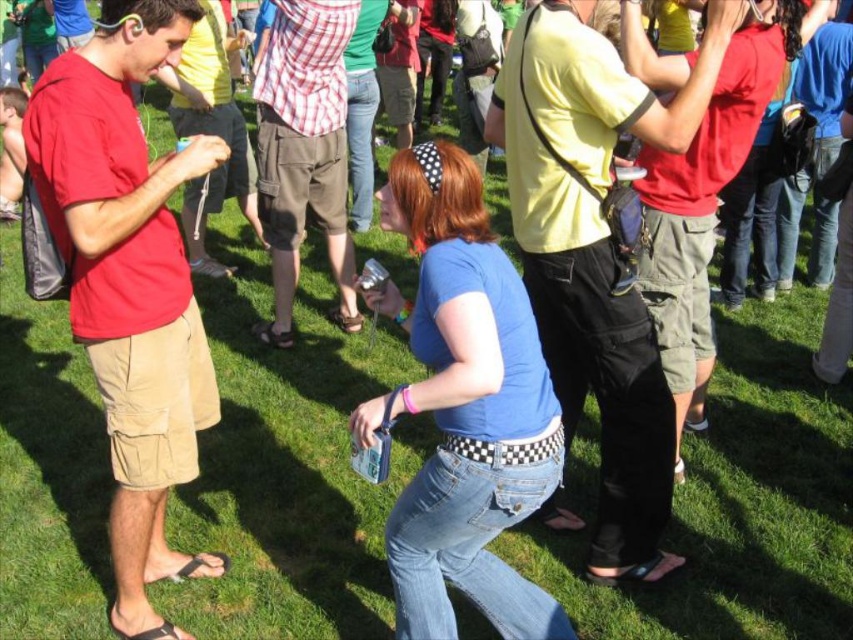
Is point (601, 316) behind point (281, 136)?

No, it is in front of (281, 136).

Does yellow cotton shirt at center have a lesser width compared to checkered fabric shirt at center?

Incorrect, yellow cotton shirt at center's width is not less than checkered fabric shirt at center's.

Which is behind, point (592, 58) or point (312, 49)?

The point (312, 49) is behind.

This screenshot has height=640, width=853. In order to click on yellow cotton shirt at center in this screenshot , I will do `click(596, 253)`.

Between matte khaki shorts at left and yellow cotton shirt at center, which one is positioned lower?

matte khaki shorts at left is below.

You are a GUI agent. You are given a task and a screenshot of the screen. Output one action in this format:
    pyautogui.click(x=<x>, y=<y>)
    Task: Click on the matte khaki shorts at left
    The image size is (853, 640).
    Given the screenshot: What is the action you would take?
    pyautogui.click(x=129, y=282)

At what (x,y) coordinates should I click in order to perform the action: click on matte khaki shorts at left. Please return your answer as a coordinate pair (x, y). Image resolution: width=853 pixels, height=640 pixels. Looking at the image, I should click on (129, 282).

Does matte khaki shorts at left have a greater width compared to checkered fabric shirt at center?

No.

Does point (107, 355) lie behind point (300, 161)?

No, (107, 355) is closer to viewer.

The width and height of the screenshot is (853, 640). In order to click on matte khaki shorts at left in this screenshot , I will do `click(129, 282)`.